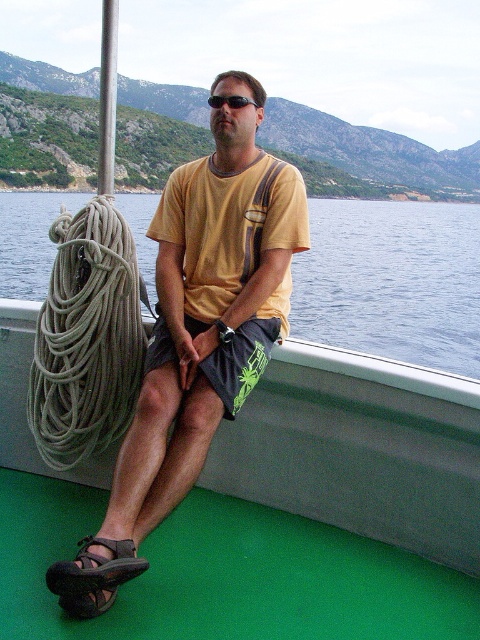
Question: Which of the following is the closest to the observer?

Choices:
 (A) gray fabric rope at left
 (B) yellow t-shirt at center

Answer: (B)

Question: Does blue water at center appear over brown leather sandal at lower left?

Choices:
 (A) yes
 (B) no

Answer: (A)

Question: Can you confirm if blue water at center is wider than brown leather sandal at lower left?

Choices:
 (A) yes
 (B) no

Answer: (A)

Question: Which object is the farthest from the yellow t-shirt at center?

Choices:
 (A) gray fabric rope at left
 (B) blue water at center
 (C) brown leather sandal at lower left

Answer: (B)

Question: Among these objects, which one is nearest to the camera?

Choices:
 (A) yellow t-shirt at center
 (B) gray fabric rope at left
 (C) blue water at center

Answer: (A)

Question: Where is yellow t-shirt at center located in relation to brown leather sandal at lower left in the image?

Choices:
 (A) above
 (B) below

Answer: (A)